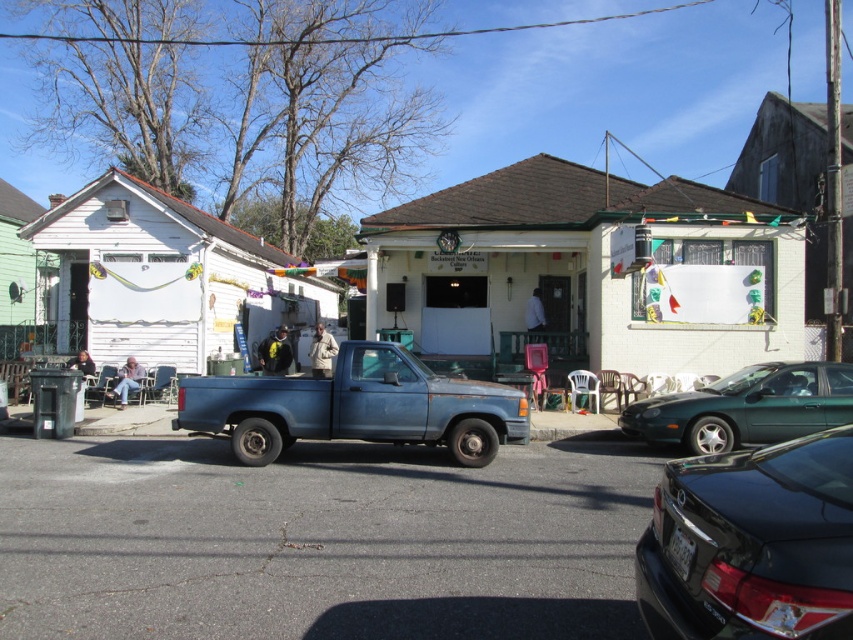
Question: Which is nearer to the rusty blue pickup truck at center?

Choices:
 (A) green matte car at center
 (B) black glossy sedan at lower right

Answer: (A)

Question: Does rusty blue pickup truck at center appear under green matte car at center?

Choices:
 (A) yes
 (B) no

Answer: (B)

Question: From the image, what is the correct spatial relationship of black glossy sedan at lower right in relation to green matte car at center?

Choices:
 (A) below
 (B) above

Answer: (B)

Question: Which point is farther from the camera taking this photo?

Choices:
 (A) (375, 410)
 (B) (695, 493)
 (C) (824, 378)

Answer: (C)

Question: Among these objects, which one is nearest to the camera?

Choices:
 (A) black glossy sedan at lower right
 (B) rusty blue pickup truck at center

Answer: (A)

Question: Can you confirm if black glossy sedan at lower right is positioned to the left of rusty blue pickup truck at center?

Choices:
 (A) yes
 (B) no

Answer: (B)